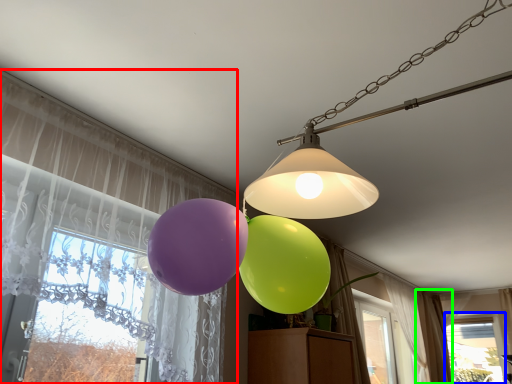
Question: Which object is positioned farthest from curtain (highlighted by a red box)? Select from window (highlighted by a blue box) and curtain (highlighted by a green box).

Choices:
 (A) window
 (B) curtain

Answer: (A)